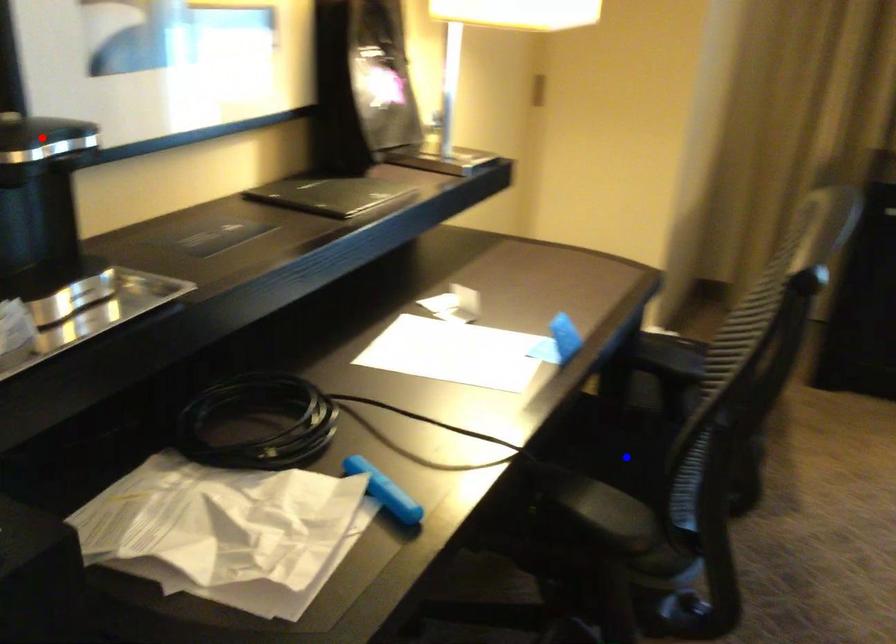
Question: In the image, two points are highlighted. Which point is nearer to the camera? Reply with the corresponding letter.

Choices:
 (A) blue point
 (B) red point

Answer: (B)